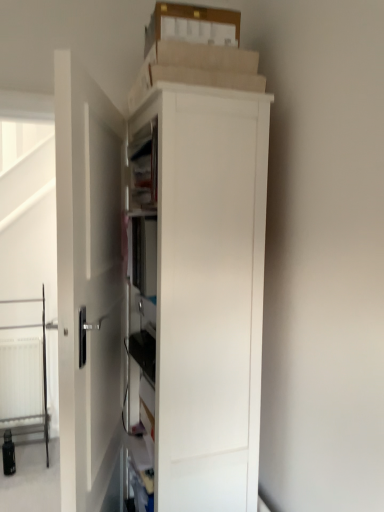
What do you see at coordinates (197, 290) in the screenshot?
I see `white matte cabinet at center` at bounding box center [197, 290].

This screenshot has height=512, width=384. What are the coordinates of `white smooth door at center` in the screenshot? It's located at (88, 283).

Where is `white matte cabinet at center`? Image resolution: width=384 pixels, height=512 pixels. white matte cabinet at center is located at coordinates (197, 290).

Does transparent glass screen door at left have a greater width compared to white plastic radiator at lower left?

Correct, the width of transparent glass screen door at left exceeds that of white plastic radiator at lower left.

Find the location of a particular element. The height and width of the screenshot is (512, 384). screen door positioned vertically above the white plastic radiator at lower left (from a real-world perspective) is located at coordinates (28, 274).

Between transparent glass screen door at left and white plastic radiator at lower left, which one appears on the right side from the viewer's perspective?

From the viewer's perspective, transparent glass screen door at left appears more on the right side.

Does point (8, 414) come farther from viewer compared to point (10, 380)?

Yes, it is.

Is white smooth door at center with transparent glass screen door at left?

No.

Considering the positions of objects white smooth door at center and transparent glass screen door at left in the image provided, who is more to the right, white smooth door at center or transparent glass screen door at left?

Answer: From the viewer's perspective, white smooth door at center appears more on the right side.

From a real-world perspective, is white smooth door at center physically located above or below transparent glass screen door at left?

From a real-world perspective, white smooth door at center is physically below transparent glass screen door at left.

Is white smooth door at center far from white matte cabinet at center?

white smooth door at center is actually quite close to white matte cabinet at center.

Which is behind, white smooth door at center or white matte cabinet at center?

Positioned behind is white matte cabinet at center.

Visually, is white smooth door at center positioned to the left or to the right of white matte cabinet at center?

From the image, it's evident that white smooth door at center is to the left of white matte cabinet at center.

Is point (85, 429) positioned in front of point (235, 187)?

Yes, it is.

Which is in front, point (36, 290) or point (95, 273)?

The point (95, 273) is in front.

From the image's perspective, is transparent glass screen door at left positioned above or below white smooth door at center?

Based on their image positions, transparent glass screen door at left is located above white smooth door at center.

Is the depth of transparent glass screen door at left less than that of white smooth door at center?

That is False.

Is white plastic radiator at lower left taller than transparent glass screen door at left?

In fact, white plastic radiator at lower left may be shorter than transparent glass screen door at left.

Considering the positions of points (30, 378) and (30, 380), is point (30, 378) farther from camera compared to point (30, 380)?

No, (30, 378) is closer to viewer.

Looking at this image, which is behind, white plastic radiator at lower left or transparent glass screen door at left?

white plastic radiator at lower left is further away from the camera.

From a real-world perspective, relative to transparent glass screen door at left, is white plastic radiator at lower left vertically above or below?

From a real-world perspective, white plastic radiator at lower left is physically below transparent glass screen door at left.

Does white plastic radiator at lower left touch white smooth door at center?

There is a gap between white plastic radiator at lower left and white smooth door at center.

Between white plastic radiator at lower left and white smooth door at center, which one has smaller width?

white smooth door at center is thinner.

Is white plastic radiator at lower left taller or shorter than white smooth door at center?

Clearly, white plastic radiator at lower left is shorter compared to white smooth door at center.

In the scene shown: Which object is positioned more to the right, white plastic radiator at lower left or white smooth door at center?

white smooth door at center.

From a real-world perspective, is white matte cabinet at center positioned above or below transparent glass screen door at left?

From a real-world perspective, white matte cabinet at center is physically below transparent glass screen door at left.

Image resolution: width=384 pixels, height=512 pixels. I want to click on screen door above the white matte cabinet at center (from a real-world perspective), so click(x=28, y=274).

Can we say white matte cabinet at center lies outside transparent glass screen door at left?

That's correct, white matte cabinet at center is outside of transparent glass screen door at left.

Locate an element on the screen. radiator that is under the transparent glass screen door at left (from a real-world perspective) is located at coordinates pyautogui.click(x=21, y=382).

This screenshot has width=384, height=512. Identify the location of door on the right of transparent glass screen door at left. (88, 283).

Which object lies nearer to the anchor point white matte cabinet at center, white smooth door at center or transparent glass screen door at left?

Based on the image, white smooth door at center appears to be nearer to white matte cabinet at center.

Looking at the image, which one is located further to white matte cabinet at center, white plastic radiator at lower left or transparent glass screen door at left?

white plastic radiator at lower left is positioned further to the anchor white matte cabinet at center.

Based on their spatial positions, is white smooth door at center or transparent glass screen door at left further from white plastic radiator at lower left?

Among the two, white smooth door at center is located further to white plastic radiator at lower left.

Estimate the real-world distances between objects in this image. Which object is closer to transparent glass screen door at left, white matte cabinet at center or white plastic radiator at lower left?

white plastic radiator at lower left lies closer to transparent glass screen door at left than the other object.

In the scene shown: Estimate the real-world distances between objects in this image. Which object is further from transparent glass screen door at left, white smooth door at center or white plastic radiator at lower left?

Among the two, white smooth door at center is located further to transparent glass screen door at left.

Considering their positions, is white plastic radiator at lower left positioned further to white smooth door at center than white matte cabinet at center?

white plastic radiator at lower left is positioned further to the anchor white smooth door at center.

Considering their positions, is white plastic radiator at lower left positioned closer to white smooth door at center than transparent glass screen door at left?

transparent glass screen door at left.

Based on their spatial positions, is transparent glass screen door at left or white matte cabinet at center closer to white smooth door at center?

white matte cabinet at center lies closer to white smooth door at center than the other object.

Image resolution: width=384 pixels, height=512 pixels. I want to click on screen door between white smooth door at center and white plastic radiator at lower left along the z-axis, so click(28, 274).

Image resolution: width=384 pixels, height=512 pixels. I want to click on screen door located between white matte cabinet at center and white plastic radiator at lower left in the depth direction, so click(x=28, y=274).

Find the location of a particular element. This screenshot has height=512, width=384. door between transparent glass screen door at left and white matte cabinet at center in the horizontal direction is located at coordinates (88, 283).

Identify the location of cupboard located between white smooth door at center and white plastic radiator at lower left in the depth direction. (197, 290).